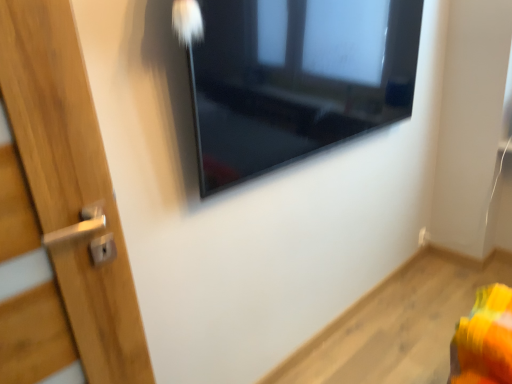
The image size is (512, 384). What do you see at coordinates (423, 237) in the screenshot?
I see `white plastic electric outlet at lower right` at bounding box center [423, 237].

Find the location of a particular element. This screenshot has height=384, width=512. white plastic electric outlet at lower right is located at coordinates (423, 237).

Find the location of a particular element. The height and width of the screenshot is (384, 512). glossy glass window at upper center is located at coordinates (292, 77).

The image size is (512, 384). Describe the element at coordinates (292, 77) in the screenshot. I see `glossy glass window at upper center` at that location.

Identify the location of white plastic electric outlet at lower right. The height and width of the screenshot is (384, 512). (423, 237).

Based on the photo, considering the positions of objects glossy glass window at upper center and white plastic electric outlet at lower right in the image provided, who is more to the right, glossy glass window at upper center or white plastic electric outlet at lower right?

white plastic electric outlet at lower right is more to the right.

Which object is further away from the camera, glossy glass window at upper center or white plastic electric outlet at lower right?

white plastic electric outlet at lower right.

Which is closer to the camera, (x=328, y=116) or (x=426, y=235)?

Point (x=328, y=116) is closer to the camera than point (x=426, y=235).

From the image's perspective, is glossy glass window at upper center located above white plastic electric outlet at lower right?

Correct, glossy glass window at upper center appears higher than white plastic electric outlet at lower right in the image.

From a real-world perspective, between glossy glass window at upper center and white plastic electric outlet at lower right, who is vertically higher?

glossy glass window at upper center is physically above.

Is glossy glass window at upper center wider or thinner than white plastic electric outlet at lower right?

Considering their sizes, glossy glass window at upper center looks broader than white plastic electric outlet at lower right.

Is glossy glass window at upper center taller than white plastic electric outlet at lower right?

Yes, glossy glass window at upper center is taller than white plastic electric outlet at lower right.

Can you confirm if glossy glass window at upper center is bigger than white plastic electric outlet at lower right?

Correct, glossy glass window at upper center is larger in size than white plastic electric outlet at lower right.

Choose the correct answer: Is glossy glass window at upper center inside white plastic electric outlet at lower right or outside it?

glossy glass window at upper center is not enclosed by white plastic electric outlet at lower right.

In the scene shown: Is glossy glass window at upper center with white plastic electric outlet at lower right?

No, glossy glass window at upper center is not in contact with white plastic electric outlet at lower right.

In the scene shown: Could you tell me if glossy glass window at upper center is facing white plastic electric outlet at lower right?

No.

At what (x,y) coordinates should I click in order to perform the action: click on electric outlet that appears behind the glossy glass window at upper center. Please return your answer as a coordinate pair (x, y). This screenshot has width=512, height=384. Looking at the image, I should click on (423, 237).

Does white plastic electric outlet at lower right appear on the right side of glossy glass window at upper center?

Indeed, white plastic electric outlet at lower right is positioned on the right side of glossy glass window at upper center.

Between white plastic electric outlet at lower right and glossy glass window at upper center, which one is positioned in front?

glossy glass window at upper center is in front.

Which is closer to the camera, (x=423, y=245) or (x=337, y=0)?

The point (x=337, y=0) is closer.

From the image's perspective, which one is positioned lower, white plastic electric outlet at lower right or glossy glass window at upper center?

white plastic electric outlet at lower right.

From a real-world perspective, between white plastic electric outlet at lower right and glossy glass window at upper center, who is vertically higher?

In real-world perspective, glossy glass window at upper center is above.

Considering the sizes of objects white plastic electric outlet at lower right and glossy glass window at upper center in the image provided, who is wider, white plastic electric outlet at lower right or glossy glass window at upper center?

Wider between the two is glossy glass window at upper center.

Who is taller, white plastic electric outlet at lower right or glossy glass window at upper center?

Standing taller between the two is glossy glass window at upper center.

Looking at the image, does white plastic electric outlet at lower right seem bigger or smaller compared to glossy glass window at upper center?

white plastic electric outlet at lower right is smaller than glossy glass window at upper center.

Is white plastic electric outlet at lower right inside or outside of glossy glass window at upper center?

white plastic electric outlet at lower right is spatially situated outside glossy glass window at upper center.

Are white plastic electric outlet at lower right and glossy glass window at upper center located far from each other?

Yes, white plastic electric outlet at lower right is far from glossy glass window at upper center.

Is white plastic electric outlet at lower right oriented away from glossy glass window at upper center?

No, white plastic electric outlet at lower right is not facing away from glossy glass window at upper center.

What's the angular difference between white plastic electric outlet at lower right and glossy glass window at upper center's facing directions?

The angular difference between white plastic electric outlet at lower right and glossy glass window at upper center is 1.7 degrees.

Measure the distance between white plastic electric outlet at lower right and glossy glass window at upper center.

1.54 meters.

Find the location of a particular element. The height and width of the screenshot is (384, 512). window in front of the white plastic electric outlet at lower right is located at coordinates (292, 77).

At what (x,y) coordinates should I click in order to perform the action: click on electric outlet below the glossy glass window at upper center (from the image's perspective). Please return your answer as a coordinate pair (x, y). The image size is (512, 384). Looking at the image, I should click on (423, 237).

Where is `electric outlet directly beneath the glossy glass window at upper center (from a real-world perspective)`? The height and width of the screenshot is (384, 512). electric outlet directly beneath the glossy glass window at upper center (from a real-world perspective) is located at coordinates 423,237.